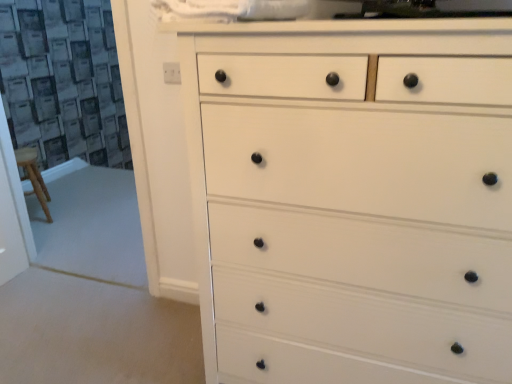
Question: Does black plastic knob at upper left appear on the right side of white painted wood chest of drawers at center?

Choices:
 (A) yes
 (B) no

Answer: (B)

Question: Could you tell me if black plastic knob at upper left is facing white painted wood chest of drawers at center?

Choices:
 (A) no
 (B) yes

Answer: (A)

Question: From the image's perspective, does black plastic knob at upper left appear lower than white painted wood chest of drawers at center?

Choices:
 (A) yes
 (B) no

Answer: (B)

Question: From the image's perspective, is black plastic knob at upper left on white painted wood chest of drawers at center?

Choices:
 (A) no
 (B) yes

Answer: (B)

Question: Can you confirm if black plastic knob at upper left is wider than white painted wood chest of drawers at center?

Choices:
 (A) yes
 (B) no

Answer: (B)

Question: Is black plastic knob at upper left located outside white painted wood chest of drawers at center?

Choices:
 (A) no
 (B) yes

Answer: (B)

Question: Is white painted wood chest of drawers at center to the left of black plastic knob at upper left from the viewer's perspective?

Choices:
 (A) yes
 (B) no

Answer: (B)

Question: From a real-world perspective, is white painted wood chest of drawers at center located higher than black plastic knob at upper left?

Choices:
 (A) yes
 (B) no

Answer: (B)

Question: From the image's perspective, is white painted wood chest of drawers at center over black plastic knob at upper left?

Choices:
 (A) no
 (B) yes

Answer: (A)

Question: Is white painted wood chest of drawers at center to the right of black plastic knob at upper left from the viewer's perspective?

Choices:
 (A) no
 (B) yes

Answer: (B)

Question: Is white painted wood chest of drawers at center far from black plastic knob at upper left?

Choices:
 (A) no
 (B) yes

Answer: (A)

Question: Does white painted wood chest of drawers at center have a smaller size compared to black plastic knob at upper left?

Choices:
 (A) yes
 (B) no

Answer: (B)

Question: Considering the positions of black plastic knob at upper left and white painted wood chest of drawers at center in the image, is black plastic knob at upper left wider or thinner than white painted wood chest of drawers at center?

Choices:
 (A) wide
 (B) thin

Answer: (B)